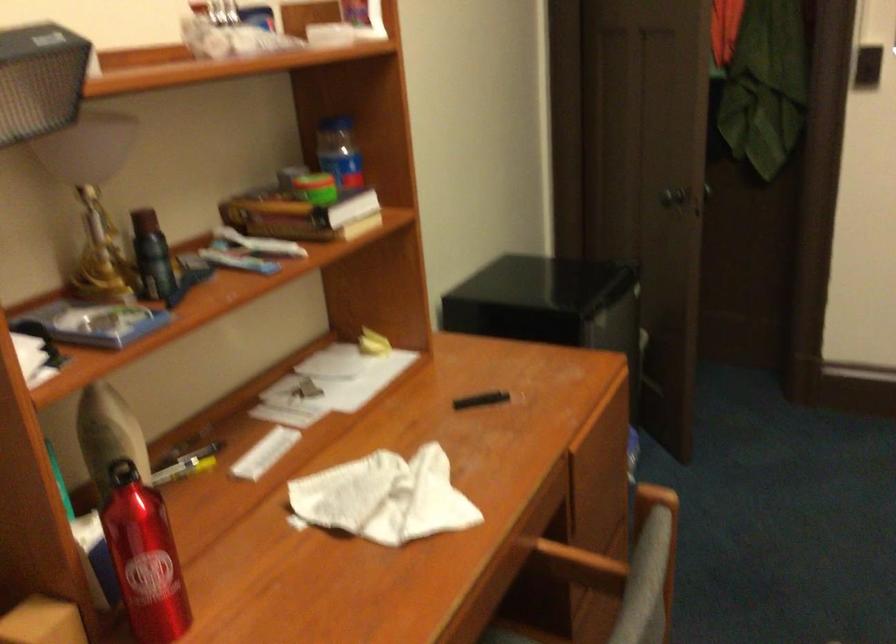
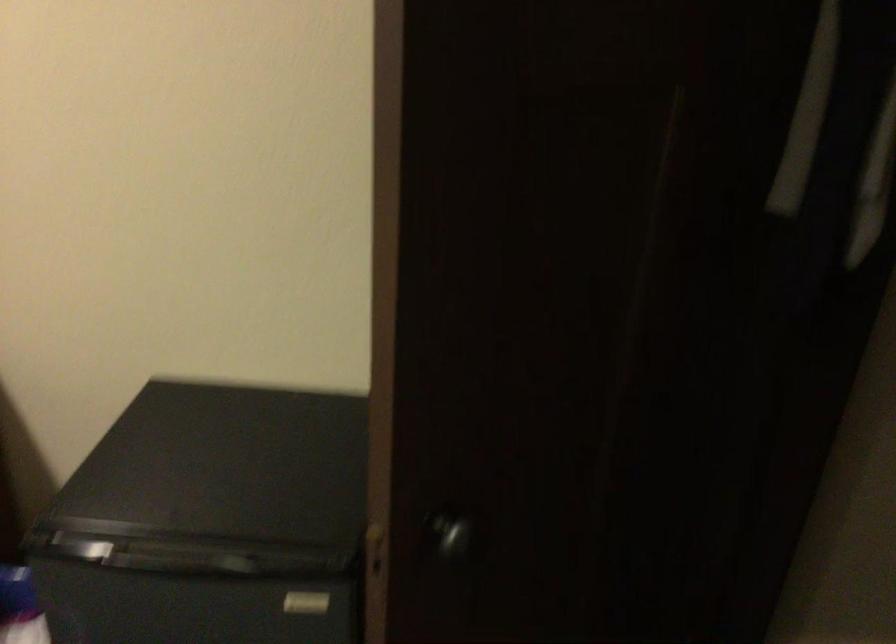
In the second image, find the point that corresponds to pixel 711 187 in the first image.

(451, 535)